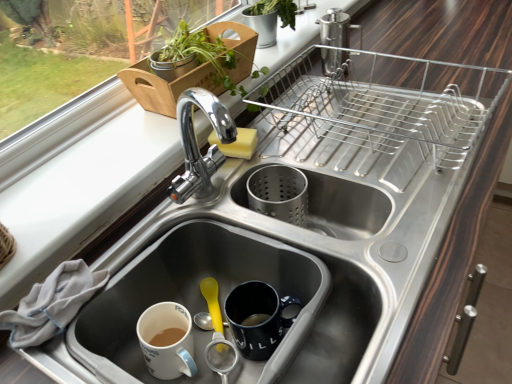
Question: Is stainless steel sink at center, acting as the second sink starting from the left, with green matte plant at upper center, the 1th houseplant when ordered from back to front?

Choices:
 (A) no
 (B) yes

Answer: (A)

Question: Is stainless steel sink at center, the 1th sink when ordered from right to left, smaller than green matte plant at upper center, which is the second houseplant in front-to-back order?

Choices:
 (A) yes
 (B) no

Answer: (B)

Question: Does stainless steel sink at center, the 1th sink when ordered from right to left, have a greater width compared to green matte plant at upper center, which is the second houseplant in front-to-back order?

Choices:
 (A) no
 (B) yes

Answer: (B)

Question: Is stainless steel sink at center, the 1th sink when ordered from right to left, bigger than green matte plant at upper center, which is the second houseplant in front-to-back order?

Choices:
 (A) yes
 (B) no

Answer: (A)

Question: Is stainless steel sink at center, acting as the second sink starting from the left, thinner than green matte plant at upper center, which is the second houseplant in front-to-back order?

Choices:
 (A) no
 (B) yes

Answer: (A)

Question: Based on their positions, is green leafy plant at upper left, which is counted as the first houseplant, starting from the front, located to the left or right of white cloth at lower left?

Choices:
 (A) left
 (B) right

Answer: (B)

Question: From the image's perspective, is green leafy plant at upper left, which is counted as the first houseplant, starting from the front, positioned above or below white cloth at lower left?

Choices:
 (A) below
 (B) above

Answer: (B)

Question: Is green leafy plant at upper left, which is counted as the first houseplant, starting from the front, in front of or behind white cloth at lower left in the image?

Choices:
 (A) behind
 (B) front

Answer: (A)

Question: Looking at their shapes, would you say green leafy plant at upper left, which ranks as the 2th houseplant in back-to-front order, is wider or thinner than white cloth at lower left?

Choices:
 (A) wide
 (B) thin

Answer: (A)

Question: In terms of height, does white matte sink at lower left, marked as the second sink in a right-to-left arrangement, look taller or shorter compared to white cloth at lower left?

Choices:
 (A) short
 (B) tall

Answer: (B)

Question: Considering the positions of white matte sink at lower left, marked as the second sink in a right-to-left arrangement, and white cloth at lower left in the image, is white matte sink at lower left, marked as the second sink in a right-to-left arrangement, bigger or smaller than white cloth at lower left?

Choices:
 (A) big
 (B) small

Answer: (A)

Question: Does point coord(233,377) appear closer or farther from the camera than point coord(33,319)?

Choices:
 (A) farther
 (B) closer

Answer: (A)

Question: From the image's perspective, is white matte sink at lower left, the 1th sink viewed from the left, positioned above or below white cloth at lower left?

Choices:
 (A) below
 (B) above

Answer: (A)

Question: From a real-world perspective, relative to white matte sink at lower left, marked as the second sink in a right-to-left arrangement, is green leafy plant at upper left, which is counted as the first houseplant, starting from the front, vertically above or below?

Choices:
 (A) above
 (B) below

Answer: (A)

Question: Considering the relative positions of green leafy plant at upper left, which ranks as the 2th houseplant in back-to-front order, and white matte sink at lower left, the 1th sink viewed from the left, in the image provided, is green leafy plant at upper left, which ranks as the 2th houseplant in back-to-front order, to the left or to the right of white matte sink at lower left, the 1th sink viewed from the left,?

Choices:
 (A) right
 (B) left

Answer: (B)